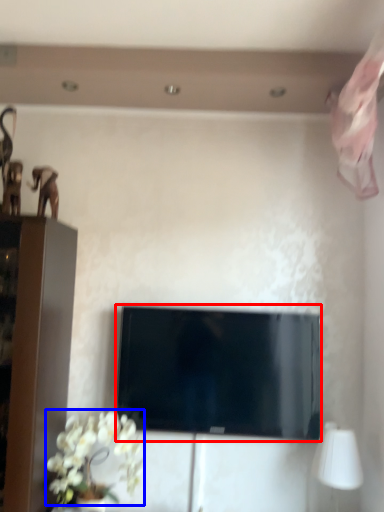
Question: Which object is further to the camera taking this photo, television (highlighted by a red box) or flower (highlighted by a blue box)?

Choices:
 (A) television
 (B) flower

Answer: (A)